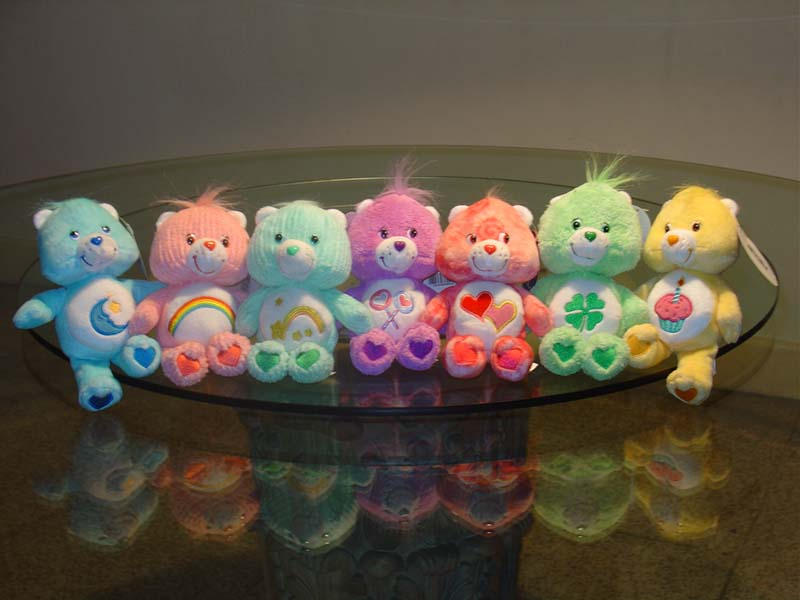
Image resolution: width=800 pixels, height=600 pixels. In order to click on orange stuffed bear in this screenshot , I will do pyautogui.click(x=482, y=215).